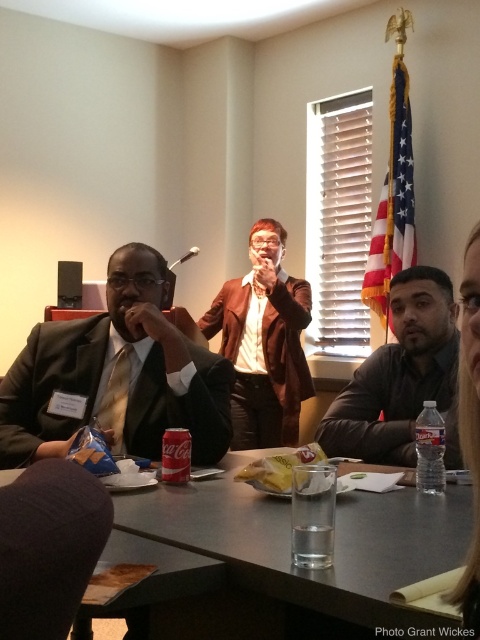
Question: Can you confirm if dark gray fabric at lower left is smaller than brown leather jacket at center?

Choices:
 (A) no
 (B) yes

Answer: (B)

Question: Is dark gray leather jacket at lower right to the right of brown leather jacket at center from the viewer's perspective?

Choices:
 (A) no
 (B) yes

Answer: (B)

Question: Considering the real-world distances, which object is closest to the smooth brown hair at upper right?

Choices:
 (A) dark gray leather jacket at lower right
 (B) dark gray fabric at lower left
 (C) brown leather jacket at center

Answer: (A)

Question: Which of the following is the farthest from the observer?

Choices:
 (A) smooth brown hair at upper right
 (B) dark gray leather jacket at lower right
 (C) brown leather jacket at center
 (D) matte black suit at left

Answer: (C)

Question: Is matte black suit at left wider than dark gray leather jacket at lower right?

Choices:
 (A) no
 (B) yes

Answer: (B)

Question: Which of these objects is positioned closest to the smooth brown hair at upper right?

Choices:
 (A) metallic gray table at center
 (B) dark gray leather jacket at lower right

Answer: (A)